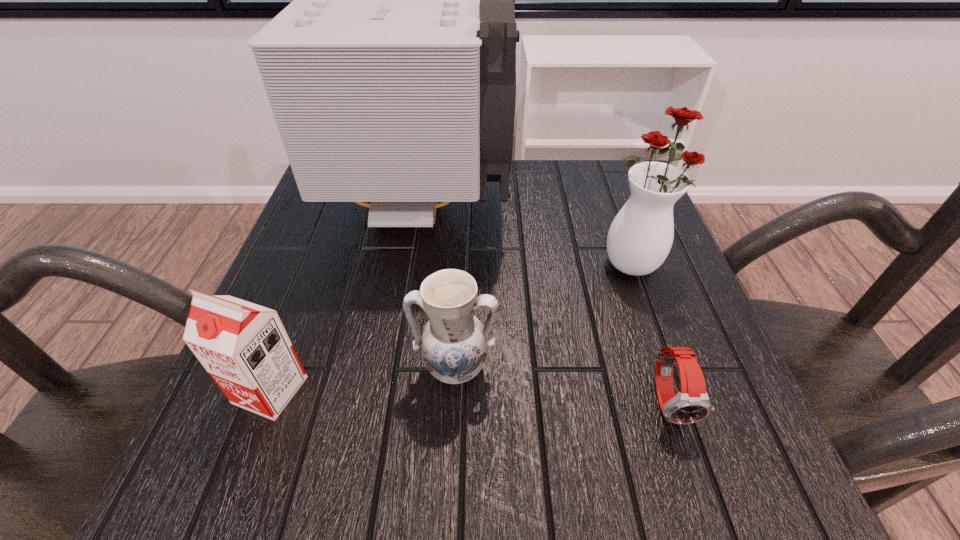
The height and width of the screenshot is (540, 960). Find the location of `the third closest object to the vase`. the third closest object to the vase is located at coordinates (454, 344).

Point out which object is positioned as the nearest to the watch. Please provide its 2D coordinates. Your answer should be formatted as a tuple, i.e. [(x, y)], where the tuple contains the x and y coordinates of a point satisfying the conditions above.

[(640, 237)]

Image resolution: width=960 pixels, height=540 pixels. In order to click on free location that satisfies the following two spatial constraints: 1. on the back side of the soya milk; 2. on the right side of the fan in this screenshot , I will do `click(340, 205)`.

Find the location of a particular element. blank space that satisfies the following two spatial constraints: 1. on the back side of the soya milk; 2. on the right side of the tallest object is located at coordinates (340, 205).